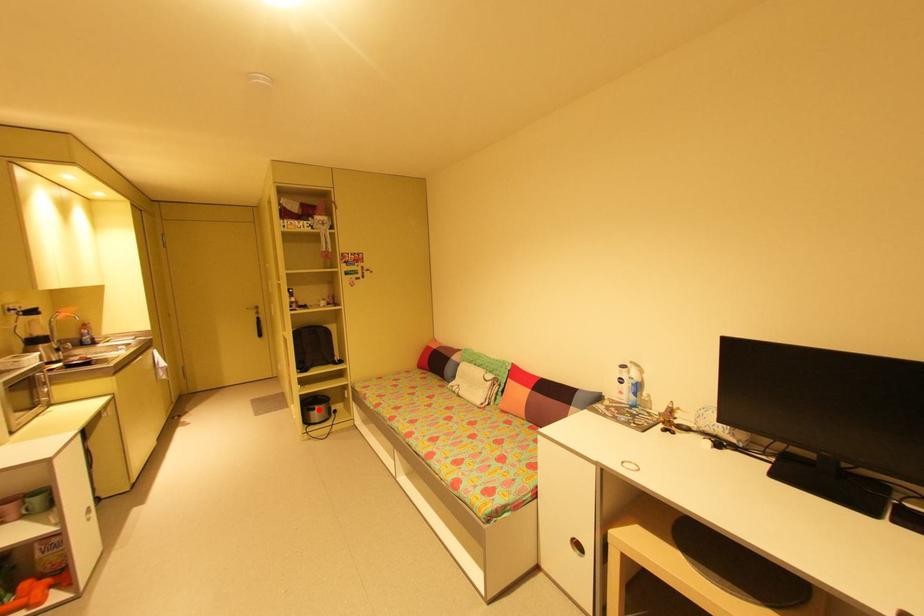
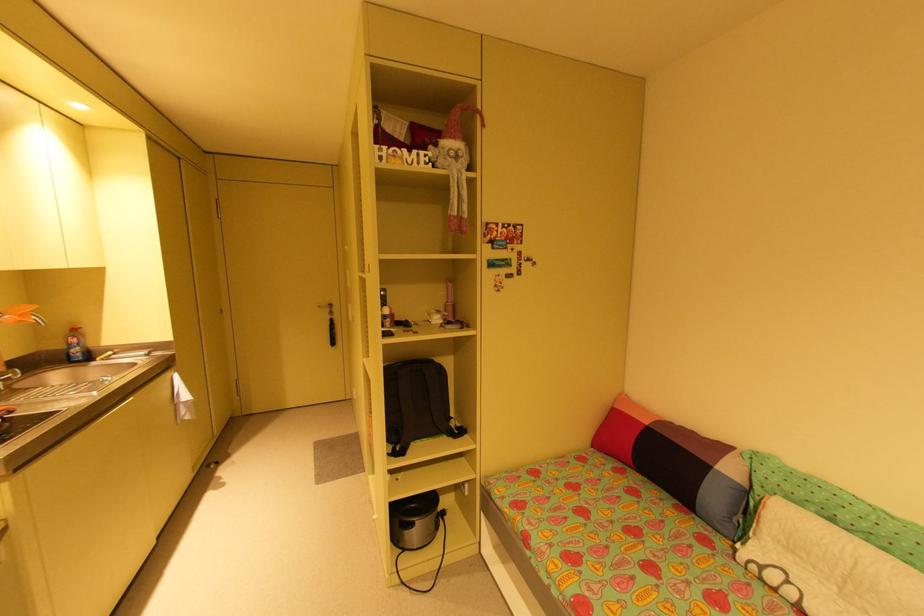
Question: A red point is marked in image1. In image2, is the corresponding 3D point closer to the camera or farther? Reply with the corresponding letter.

Choices:
 (A) The corresponding 3D point is closer.
 (B) The corresponding 3D point is farther.

Answer: (A)